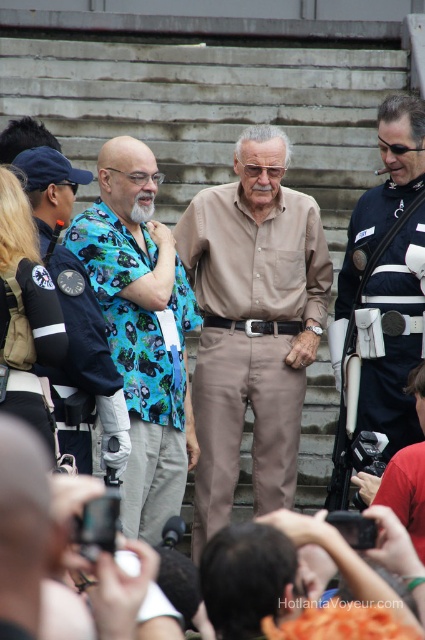
You are a photographer trying to capture a clear shot of the notable person standing on the concrete stairs. There are two objects in your way, the blue floral shirt at center and the black plastic video camera at center. Which object is closer to you, blocking your view first?

The blue floral shirt at center is closer to you than the black plastic video camera at center, so it is the first object blocking your view.

You are a photographer at the event and need to ensure that both the matte khaki pants at center and the blue printed shirt at center are visible in your photo. Given their sizes, which one might you need to adjust your focus on to ensure clarity?

The matte khaki pants at center is larger in size compared to the blue printed shirt at center, so you should focus on the matte khaki pants at center to ensure it is clearly visible in the photo.

From the picture: You are standing at the bottom of the concrete stairs in the image and want to take a photo of the central figure. There are two points marked in the scene, point A at coordinates point (311,211) and point B at coordinates point (133,429). Which point should you move to in order to be closer to the central figure?

Point B at coordinates point (133,429) is closer to the central figure because it is closer to the camera than point A at coordinates point (311,211).